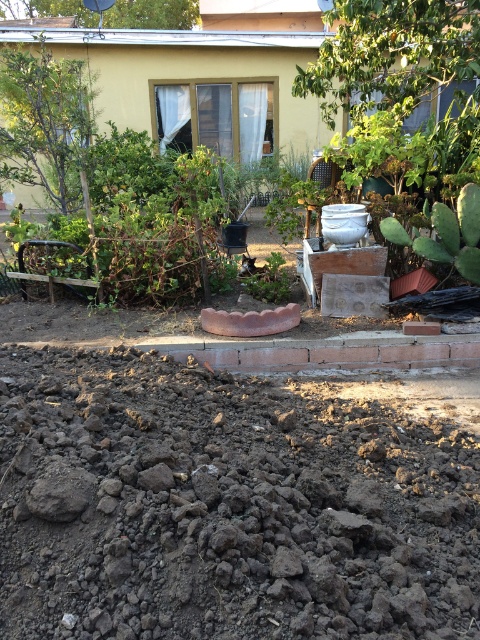
Question: Which point is closer to the camera?

Choices:
 (A) green matte plant at center
 (B) green spiky cactus at right

Answer: (B)

Question: Does dull brown soil at lower center appear over green matte plant at center?

Choices:
 (A) no
 (B) yes

Answer: (A)

Question: Which of the following is the closest to the observer?

Choices:
 (A) (245, 284)
 (B) (291, 605)
 (C) (470, 241)

Answer: (B)

Question: Does dull brown soil at lower center appear under green spiky cactus at right?

Choices:
 (A) no
 (B) yes

Answer: (B)

Question: Is dull brown soil at lower center wider than green spiky cactus at right?

Choices:
 (A) yes
 (B) no

Answer: (A)

Question: Considering the real-world distances, which object is farthest from the green spiky cactus at right?

Choices:
 (A) green matte plant at center
 (B) dull brown soil at lower center

Answer: (B)